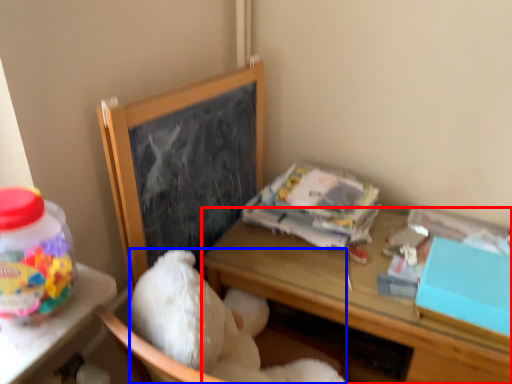
Question: Which object appears farthest to the camera in this image, desk (highlighted by a red box) or teddy bear (highlighted by a blue box)?

Choices:
 (A) desk
 (B) teddy bear

Answer: (A)